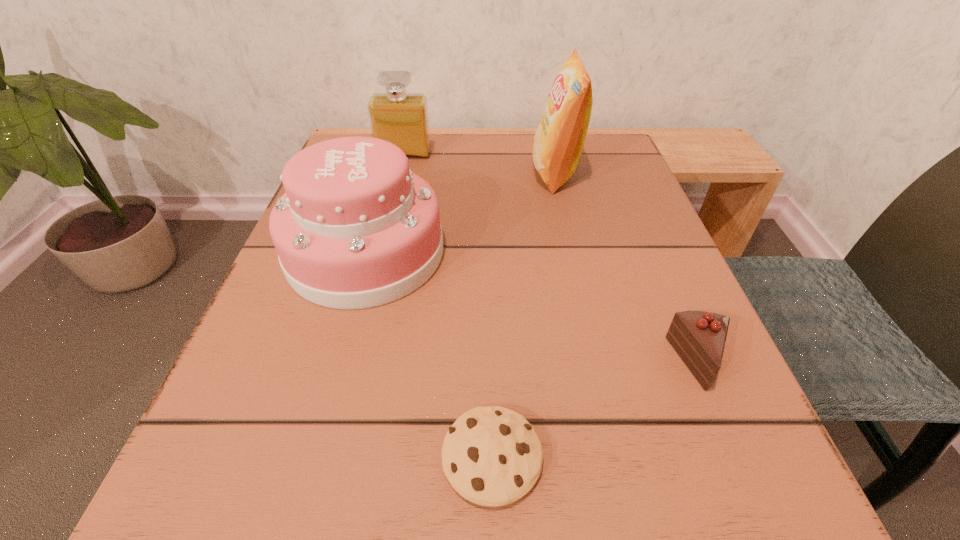
Identify the location of the fourth object from left to right. The image size is (960, 540). (558, 143).

You are a GUI agent. You are given a task and a screenshot of the screen. Output one action in this format:
    pyautogui.click(x=<x>, y=<y>)
    Task: Click on the tallest object
    This screenshot has width=960, height=540.
    Given the screenshot: What is the action you would take?
    pyautogui.click(x=558, y=143)

Identify the location of perfume. This screenshot has width=960, height=540. (401, 118).

What are the coordinates of `the third farthest object` in the screenshot? It's located at [x=355, y=229].

Find the location of a particular element. The width and height of the screenshot is (960, 540). the second shortest object is located at coordinates (699, 337).

You are a GUI agent. You are given a task and a screenshot of the screen. Output one action in this format:
    pyautogui.click(x=<x>, y=<y>)
    Task: Click on the fourth farthest object
    This screenshot has width=960, height=540.
    Given the screenshot: What is the action you would take?
    pyautogui.click(x=699, y=337)

Locate an element on the screen. The width and height of the screenshot is (960, 540). cookie is located at coordinates (492, 456).

The height and width of the screenshot is (540, 960). Identify the location of the shortest object. pos(492,456).

Where is `blank space located 0.100m on the front-facing side of the tallest object`? This screenshot has width=960, height=540. blank space located 0.100m on the front-facing side of the tallest object is located at coordinates (483, 173).

Image resolution: width=960 pixels, height=540 pixels. I want to click on free space located 0.170m on the front-facing side of the tallest object, so pos(449,173).